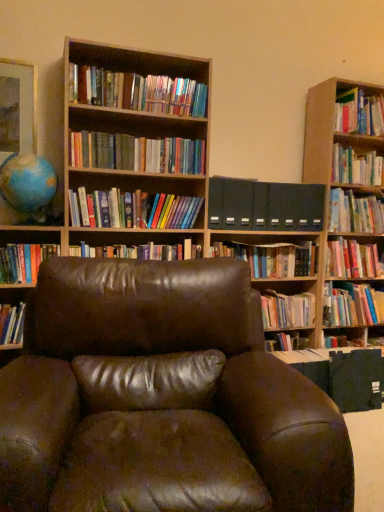
Question: Does hardcover book at center, marked as the ninth book in a top-to-bottom arrangement, have a lesser width compared to hardcover books at center, acting as the 7th book starting from the top?

Choices:
 (A) yes
 (B) no

Answer: (B)

Question: From a real-world perspective, does hardcover book at center, arranged as the fifth book when ordered from the bottom, sit lower than hardcover books at center, marked as the 7th book in a bottom-to-top arrangement?

Choices:
 (A) no
 (B) yes

Answer: (B)

Question: Does hardcover book at center, marked as the ninth book in a top-to-bottom arrangement, have a lesser height compared to hardcover books at center, acting as the 7th book starting from the top?

Choices:
 (A) yes
 (B) no

Answer: (B)

Question: Is hardcover book at center, arranged as the fifth book when ordered from the bottom, positioned in front of hardcover books at center, acting as the 7th book starting from the top?

Choices:
 (A) yes
 (B) no

Answer: (B)

Question: Is hardcover book at center, arranged as the fifth book when ordered from the bottom, taller than hardcover books at center, marked as the 7th book in a bottom-to-top arrangement?

Choices:
 (A) yes
 (B) no

Answer: (A)

Question: Is hardcover book at center, arranged as the fifth book when ordered from the bottom, oriented away from hardcover books at center, acting as the 7th book starting from the top?

Choices:
 (A) no
 (B) yes

Answer: (A)

Question: Is matte gold picture frame at upper left further to camera compared to hardcover book at upper right, positioned as the first book in top-to-bottom order?

Choices:
 (A) no
 (B) yes

Answer: (A)

Question: From the image's perspective, is matte gold picture frame at upper left located above hardcover book at upper right, positioned as the first book in top-to-bottom order?

Choices:
 (A) no
 (B) yes

Answer: (A)

Question: From a real-world perspective, is matte gold picture frame at upper left physically above hardcover book at upper right, positioned as the first book in top-to-bottom order?

Choices:
 (A) yes
 (B) no

Answer: (B)

Question: Is matte gold picture frame at upper left at the left side of hardcover book at upper right, which is counted as the 13th book, starting from the bottom?

Choices:
 (A) yes
 (B) no

Answer: (A)

Question: Does matte gold picture frame at upper left have a greater width compared to hardcover book at upper right, which is counted as the 13th book, starting from the bottom?

Choices:
 (A) no
 (B) yes

Answer: (A)

Question: Is the depth of matte gold picture frame at upper left less than that of hardcover book at upper right, which is counted as the 13th book, starting from the bottom?

Choices:
 (A) yes
 (B) no

Answer: (A)

Question: From a real-world perspective, is hardcover book at upper right, acting as the 5th book starting from the top, on top of hardcover book at upper right, which is counted as the 13th book, starting from the bottom?

Choices:
 (A) yes
 (B) no

Answer: (B)